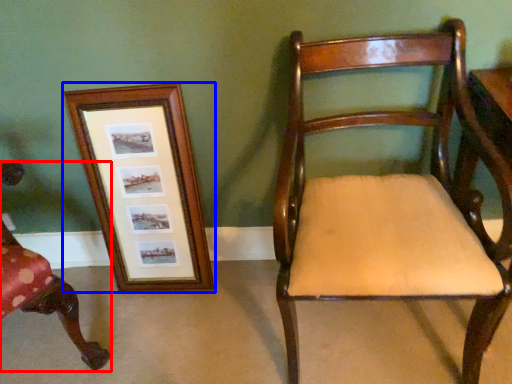
Question: Which of the following is the farthest to the observer, chair (highlighted by a red box) or picture frame (highlighted by a blue box)?

Choices:
 (A) chair
 (B) picture frame

Answer: (B)